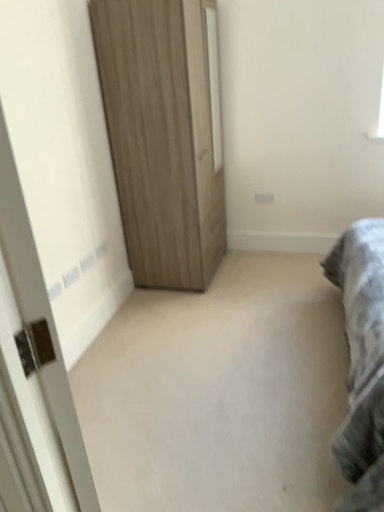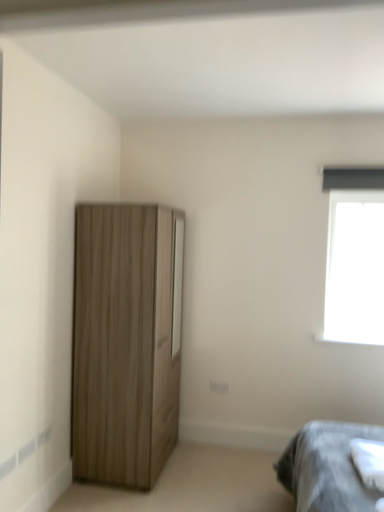
Question: Which way did the camera rotate in the video?

Choices:
 (A) rotated upward
 (B) rotated downward

Answer: (A)